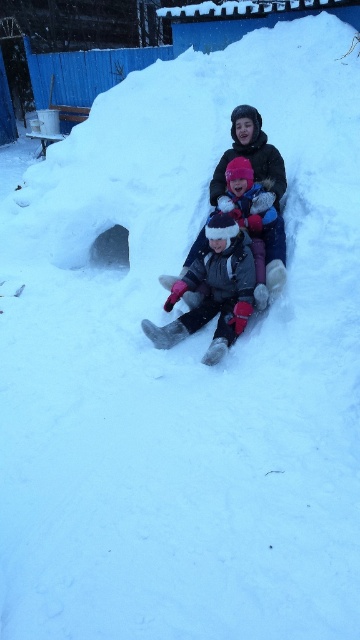
Question: Among these objects, which one is nearest to the camera?

Choices:
 (A) gray woolen hat at center
 (B) fluffy pink hat at center

Answer: (A)

Question: Does gray woolen hat at center appear on the right side of fluffy pink hat at center?

Choices:
 (A) yes
 (B) no

Answer: (B)

Question: Among these points, which one is farthest from the camera?

Choices:
 (A) (251, 237)
 (B) (206, 308)

Answer: (B)

Question: Can you confirm if gray woolen hat at center is positioned to the right of fluffy pink hat at center?

Choices:
 (A) yes
 (B) no

Answer: (B)

Question: From the image, what is the correct spatial relationship of gray woolen hat at center in relation to fluffy pink hat at center?

Choices:
 (A) above
 (B) below

Answer: (B)